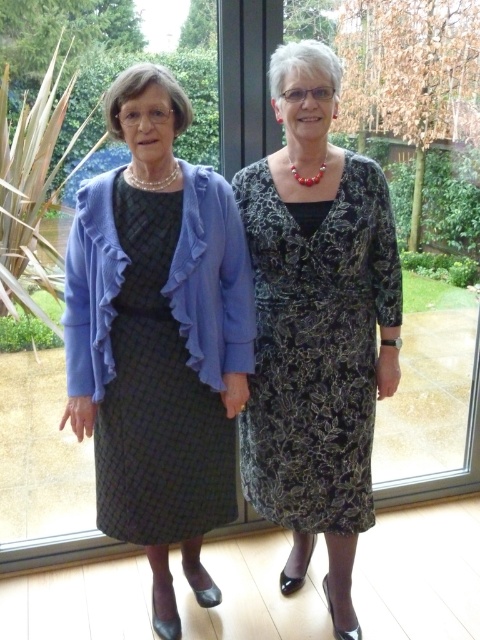
You are a photographer adjusting the camera settings to focus on the black textured dress at center. Based on the coordinates provided, is the dress positioned closer to the left or right side of the image?

The black textured dress at center is located at point 0.541 on the horizontal axis, which places it closer to the center rather than the left or right side of the image.

In the scene shown: You are a photographer setting up a shoot for two women standing near a glass door. You notice the matte blue cardigan at left and the black textured dress at center. Which object is closer to the bottom of the image?

The matte blue cardigan at left is positioned under the black textured dress at center, so it is closer to the bottom of the image.

You are a photographer adjusting the lighting in the studio. You need to place a spotlight at point [159,337] to highlight an object. Which object from the scene should the spotlight illuminate?

The spotlight at point [159,337] should illuminate the matte blue cardigan at left.